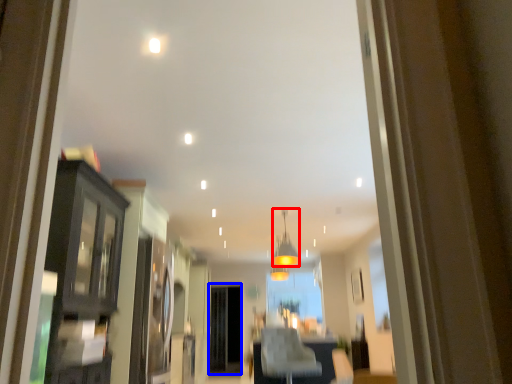
Question: Among these objects, which one is farthest to the camera, light fixture (highlighted by a red box) or screen door (highlighted by a blue box)?

Choices:
 (A) light fixture
 (B) screen door

Answer: (B)